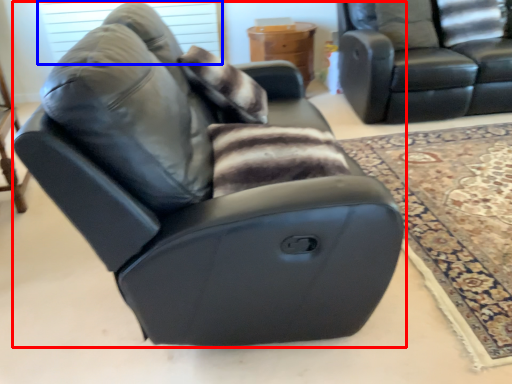
Question: Which of the following is the farthest to the observer, chair (highlighted by a red box) or window screen (highlighted by a blue box)?

Choices:
 (A) chair
 (B) window screen

Answer: (B)